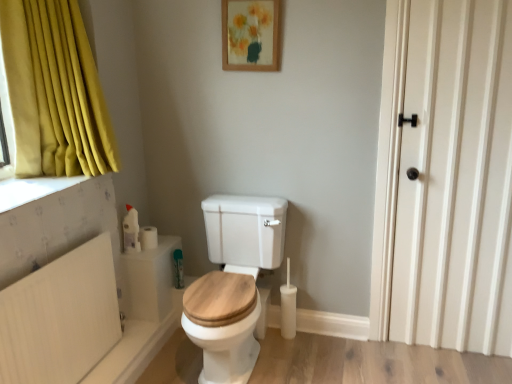
Find the location of `free point to the right of wooden toilet seat at center`. free point to the right of wooden toilet seat at center is located at coordinates (323, 358).